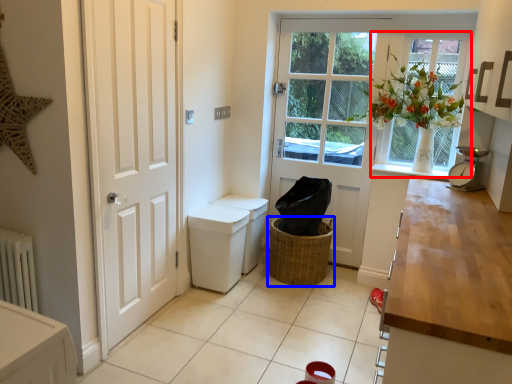
Question: Which object appears farthest to the camera in this image, window (highlighted by a red box) or basket (highlighted by a blue box)?

Choices:
 (A) window
 (B) basket

Answer: (B)